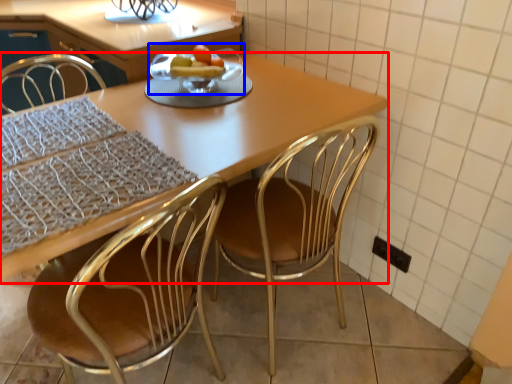
Question: Which of the following is the farthest to the observer, kitchen & dining room table (highlighted by a red box) or fruit dish (highlighted by a blue box)?

Choices:
 (A) kitchen & dining room table
 (B) fruit dish

Answer: (B)